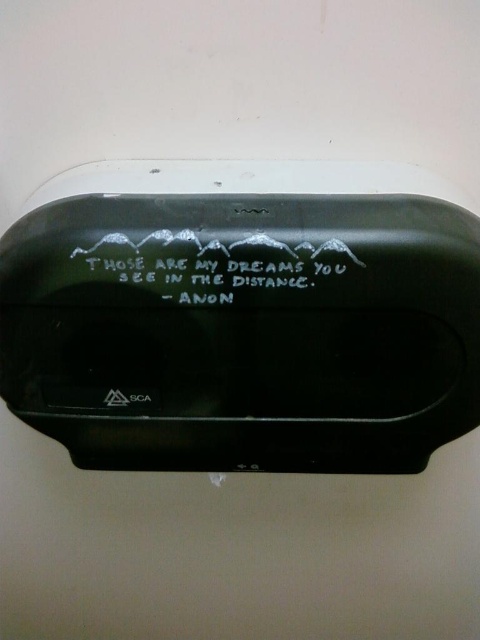
Question: Which point is farther from the camera taking this photo?

Choices:
 (A) (245, 220)
 (B) (109, 260)

Answer: (B)

Question: Is matte black mirror at center positioned at the back of white matte text at center?

Choices:
 (A) yes
 (B) no

Answer: (B)

Question: Which point is farther to the camera?

Choices:
 (A) white matte text at center
 (B) matte black mirror at center

Answer: (A)

Question: Is matte black mirror at center thinner than white matte text at center?

Choices:
 (A) yes
 (B) no

Answer: (B)

Question: Can you confirm if matte black mirror at center is smaller than white matte text at center?

Choices:
 (A) no
 (B) yes

Answer: (A)